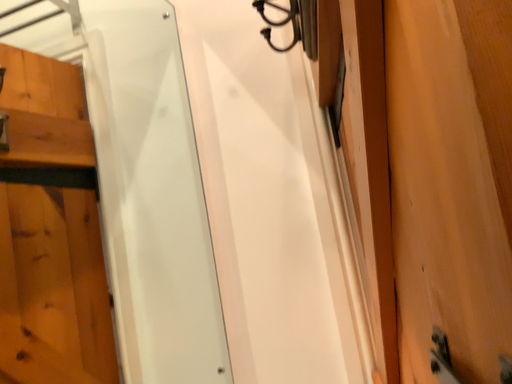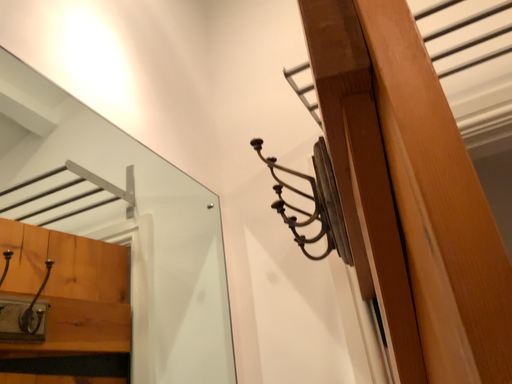
Question: Which way did the camera rotate in the video?

Choices:
 (A) rotated right
 (B) rotated left

Answer: (B)